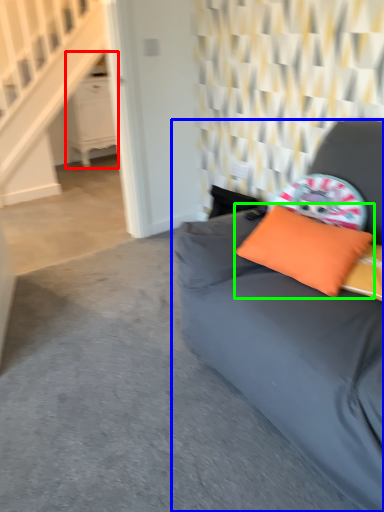
Question: Which object is positioned closest to dresser (highlighted by a red box)? Select from studio couch (highlighted by a blue box) and pillow (highlighted by a green box).

Choices:
 (A) studio couch
 (B) pillow

Answer: (A)